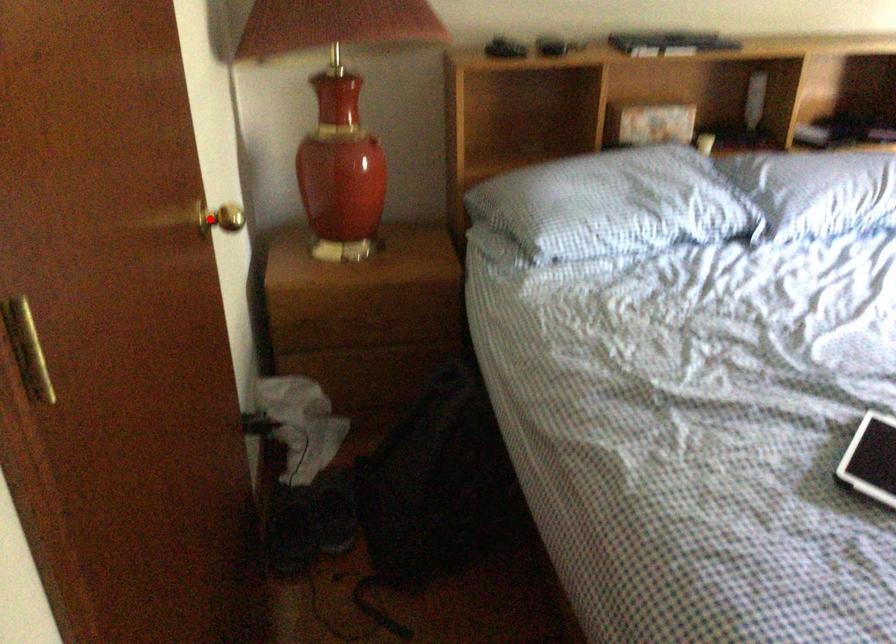
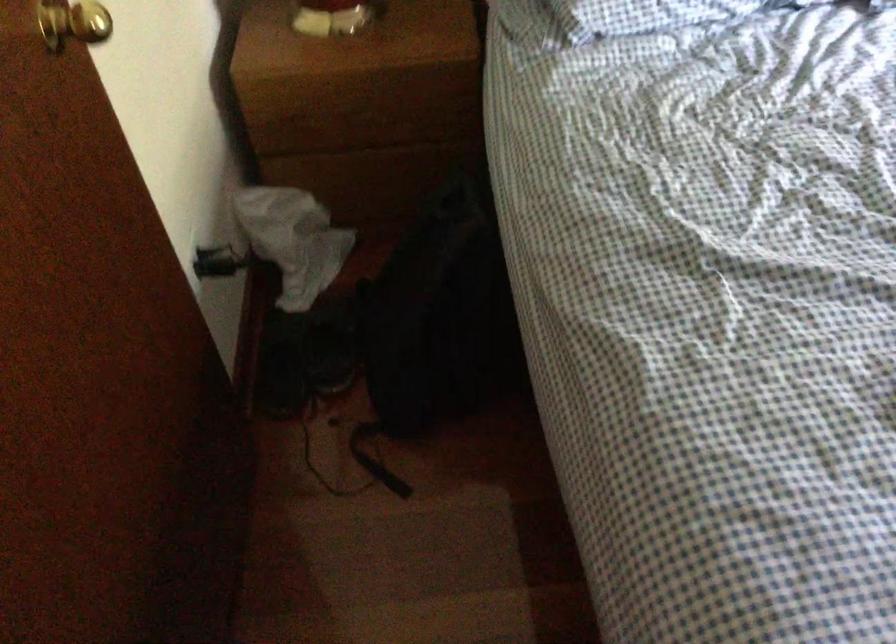
The point at the highlighted location is marked in the first image. Where is the corresponding point in the second image?

(73, 23)